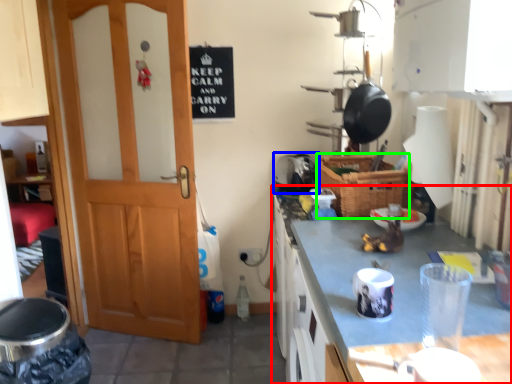
Question: Based on their relative distances, which object is nearer to cabinetry (highlighted by a red box)? Choose from appliance (highlighted by a blue box) and basket (highlighted by a green box).

Choices:
 (A) appliance
 (B) basket

Answer: (B)